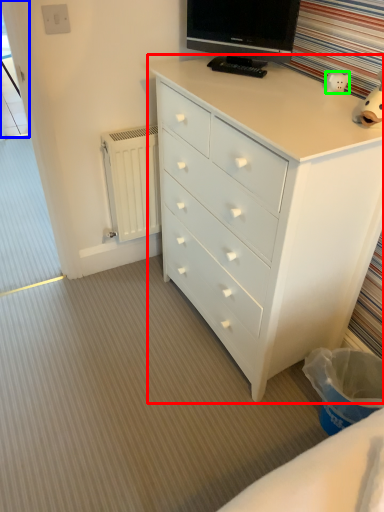
Question: Which is nearer to the chest of drawers (highlighted by a red box)? screen door (highlighted by a blue box) or toy (highlighted by a green box).

Choices:
 (A) screen door
 (B) toy

Answer: (B)